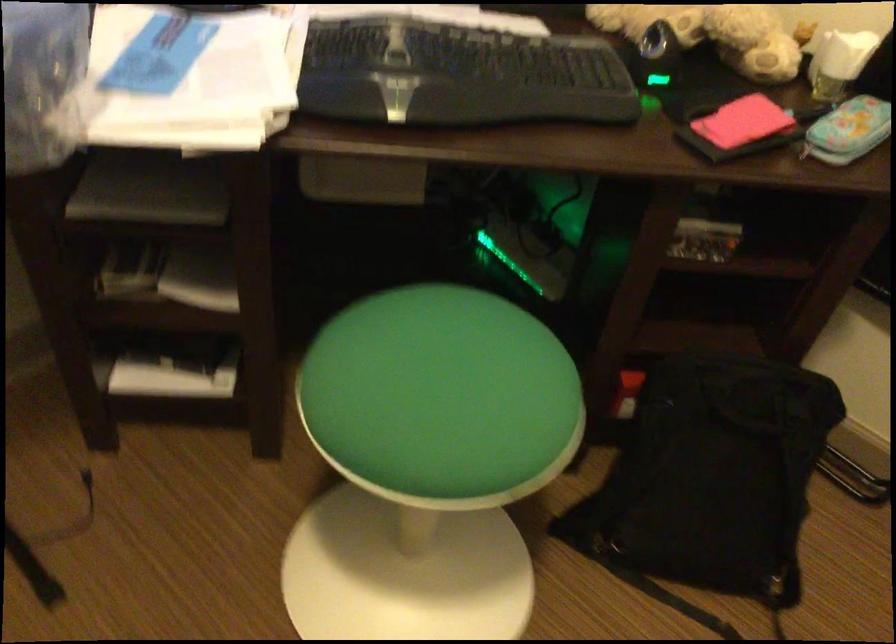
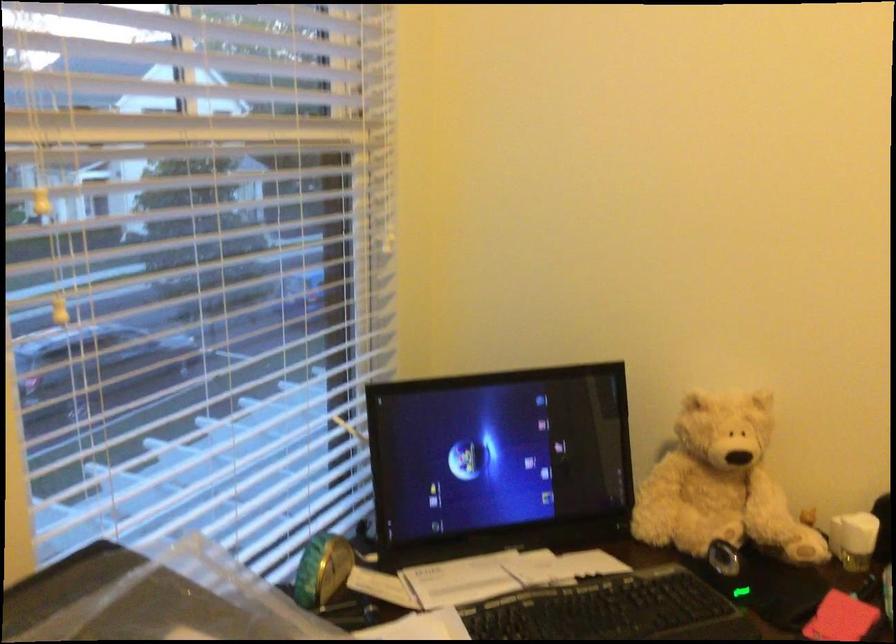
Find the pixel in the second image that matches pixel 737 118 in the first image.

(840, 618)